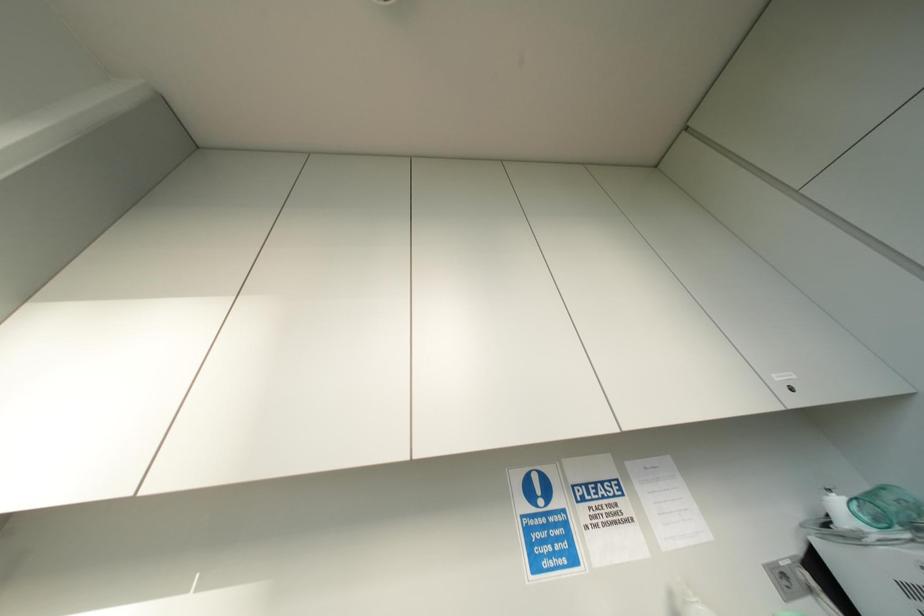
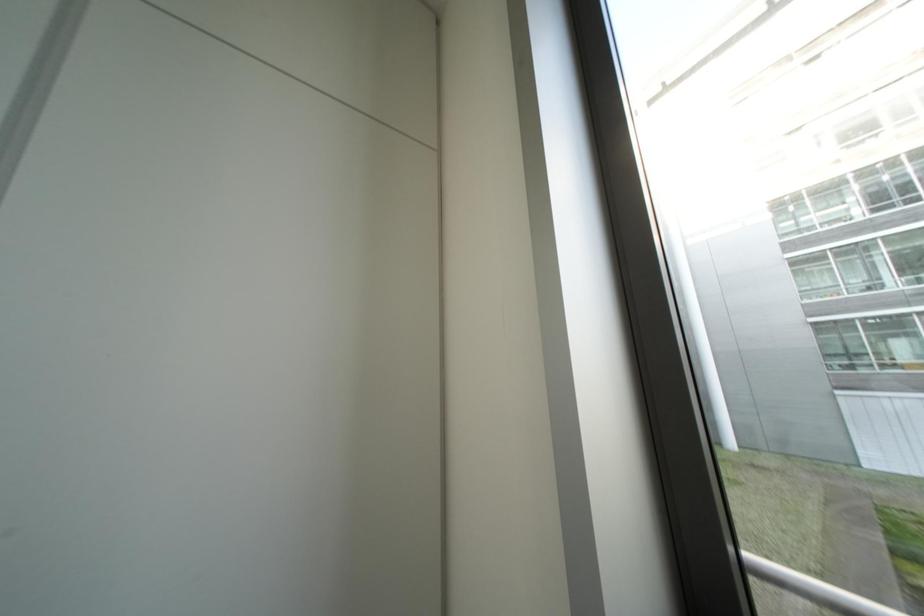
First-person continuous shooting, in which direction is the camera rotating?

The rotation direction of the camera is right-up.